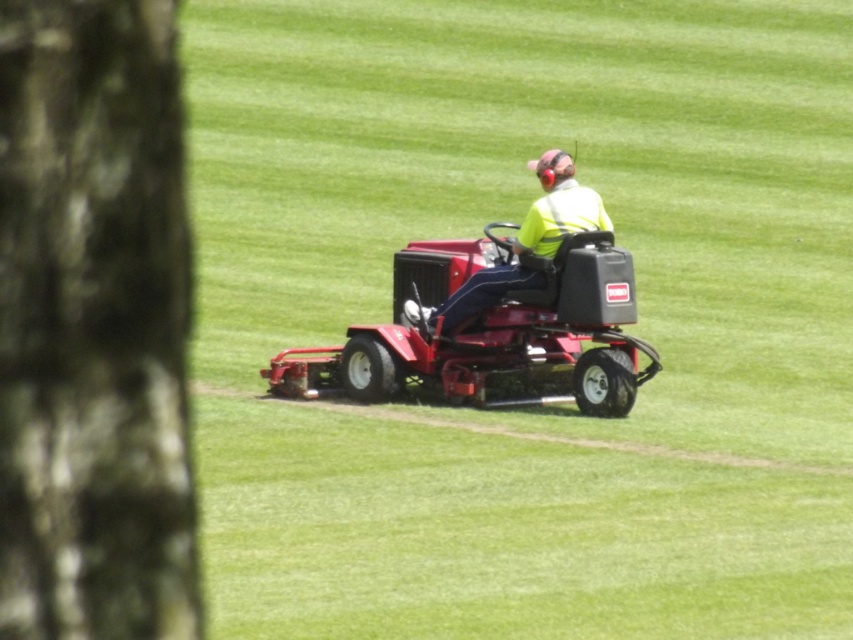
Question: From the image, what is the correct spatial relationship of dark brown bark at left in relation to yellow reflective vest at center?

Choices:
 (A) left
 (B) right

Answer: (A)

Question: Among these objects, which one is farthest from the camera?

Choices:
 (A) yellow reflective vest at center
 (B) dark brown bark at left

Answer: (A)

Question: Can you confirm if dark brown bark at left is positioned to the right of yellow reflective vest at center?

Choices:
 (A) yes
 (B) no

Answer: (B)

Question: Which of the following is the closest to the observer?

Choices:
 (A) dark brown bark at left
 (B) yellow reflective vest at center

Answer: (A)

Question: Which of the following is the farthest from the observer?

Choices:
 (A) yellow reflective vest at center
 (B) dark brown bark at left

Answer: (A)

Question: Can you confirm if dark brown bark at left is wider than yellow reflective vest at center?

Choices:
 (A) no
 (B) yes

Answer: (A)